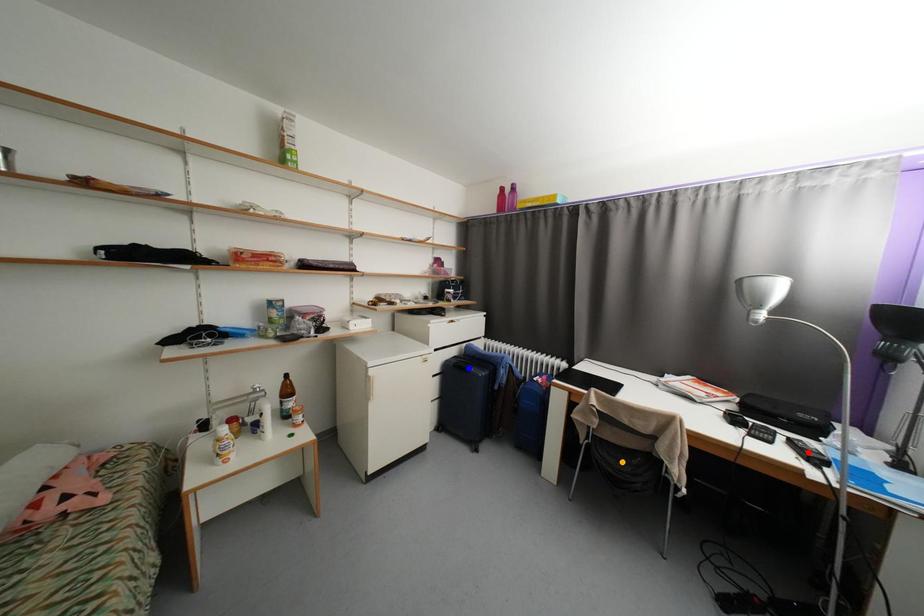
Order these from nearest to farthest:
- orange point
- blue point
- red point

red point
orange point
blue point